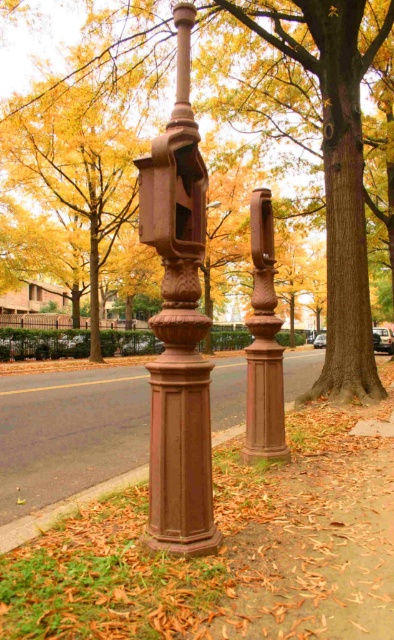
You are standing on the sidewalk in front of the two vintage fire alarm boxes. You notice two points marked on the ground at coordinates point [178,74] and point [226,428]. Which point is closer to you?

Point [178,74] is closer to the viewer than point [226,428].

You are a city planner assessing the spacing between two brown polished stone post at center and brown polished pillar at center in the image. According to city regulations, the minimum distance between such structures should be 10 meters. Is the current spacing compliant with the regulations?

The brown polished stone post at center is 9.19 meters from the brown polished pillar at center. Since the required minimum distance is 10 meters, the current spacing is not compliant with the regulations.

You are a delivery person with a cart that is 5 feet wide. You need to move your cart between the rusty metal pillar at center and the brown cast iron at lower center. Can you fit your cart through the space between them?

The distance between the rusty metal pillar at center and the brown cast iron at lower center is 6.23 feet. Since your cart is 5 feet wide, it can fit through the space between them as the distance is greater than the cart width.